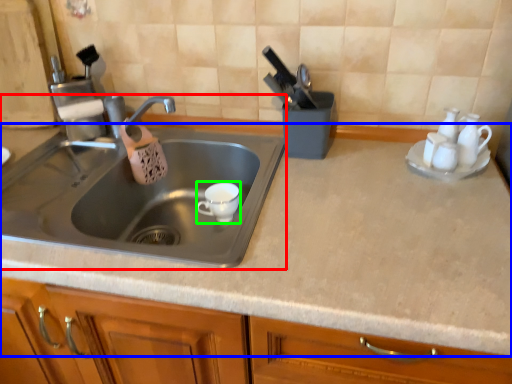
Question: Which is nearer to the sink (highlighted by a red box)? countertop (highlighted by a blue box) or tableware (highlighted by a green box).

Choices:
 (A) countertop
 (B) tableware

Answer: (B)